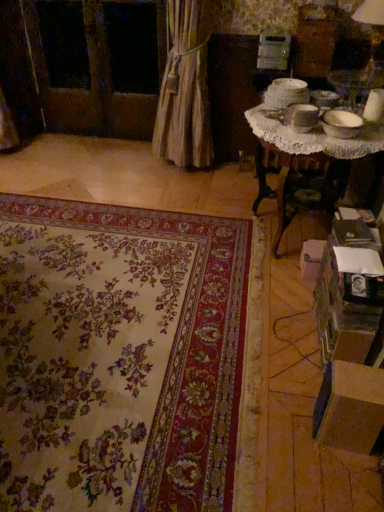
Identify the location of vacant space situated on the left part of beige fabric curtain at left. (127, 162).